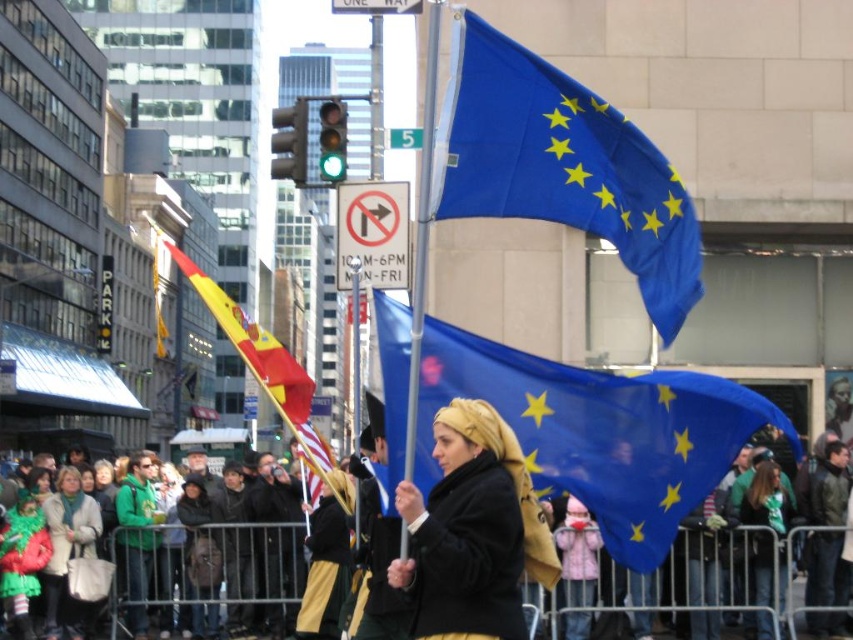
Which of these two, black jacket at center or green wool scarf at lower left, stands shorter?

green wool scarf at lower left

Between black jacket at center and green wool scarf at lower left, which one has more height?

black jacket at center is taller.

You are a GUI agent. You are given a task and a screenshot of the screen. Output one action in this format:
    pyautogui.click(x=<x>, y=<y>)
    Task: Click on the black jacket at center
    The width and height of the screenshot is (853, 640).
    Given the screenshot: What is the action you would take?
    689,579

Which is more to the left, blue fabric flag at upper center or black jacket at center?

Positioned to the left is black jacket at center.

Measure the distance from blue fabric flag at upper center to black jacket at center.

blue fabric flag at upper center is 68.61 feet away from black jacket at center.

Does point (599, 134) come in front of point (256, 518)?

Yes, it is.

You are a GUI agent. You are given a task and a screenshot of the screen. Output one action in this format:
    pyautogui.click(x=<x>, y=<y>)
    Task: Click on the blue fabric flag at upper center
    The image size is (853, 640).
    Given the screenshot: What is the action you would take?
    pyautogui.click(x=561, y=164)

Does blue fabric flag at center have a greater height compared to green wool scarf at lower left?

Yes, blue fabric flag at center is taller than green wool scarf at lower left.

Who is more distant from viewer, (x=405, y=401) or (x=229, y=516)?

The point (x=229, y=516) is more distant.

This screenshot has width=853, height=640. I want to click on blue fabric flag at center, so click(598, 433).